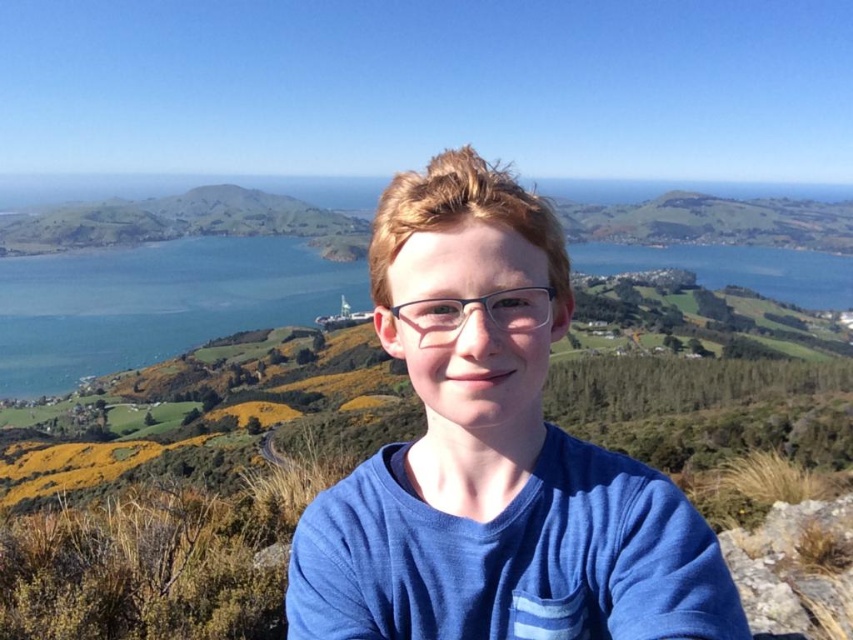
You are a photographer trying to capture the scenic landscape. You notice a point at coordinates (x=492, y=456) in the image. What object is located at that point?

The point at coordinates (x=492, y=456) indicates the blue cotton shirt at center.

You are a photographer planning to take a portrait of the person wearing the blue cotton shirt at center. To ensure the subject is centered in the frame, where should you position the camera relative to the person?

The blue cotton shirt at center is already positioned at point (492, 456), so to center the subject in the frame, move the camera slightly to the left and upward to align the shirt with the center of the frame.

You are a photographer trying to capture a closeup of the blue cotton shirt at center and clear plastic glasses at center. Which object should you zoom in on to ensure both fit in the frame without cropping?

The blue cotton shirt at center is larger in size than clear plastic glasses at center, so you should zoom in on the blue cotton shirt at center to ensure both fit in the frame without cropping.